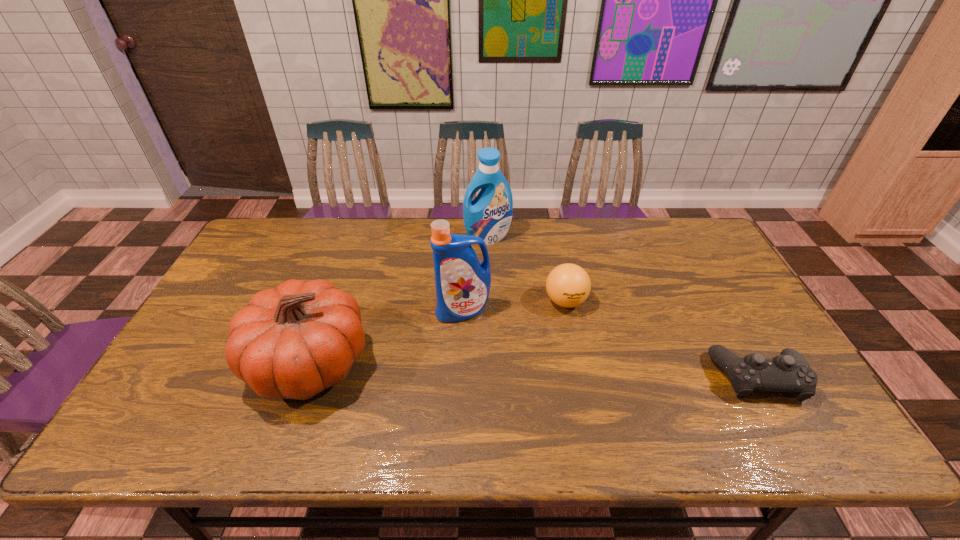
Find the location of a particular element. vacant region located 0.050m on the label of the nearer detergent is located at coordinates (468, 337).

You are a GUI agent. You are given a task and a screenshot of the screen. Output one action in this format:
    pyautogui.click(x=<x>, y=<y>)
    Task: Click on the object situated at the far edge
    Image resolution: width=960 pixels, height=540 pixels.
    Given the screenshot: What is the action you would take?
    tap(488, 216)

At what (x,y) coordinates should I click in order to perform the action: click on pumpkin that is at the near edge. Please return your answer as a coordinate pair (x, y). The width and height of the screenshot is (960, 540). Looking at the image, I should click on (293, 341).

This screenshot has width=960, height=540. Find the location of `control that is at the near edge`. control that is at the near edge is located at coordinates (789, 372).

This screenshot has width=960, height=540. Find the location of `object that is at the right edge`. object that is at the right edge is located at coordinates (789, 372).

Where is `object that is at the near right corner`? object that is at the near right corner is located at coordinates (789, 372).

This screenshot has width=960, height=540. In the image, there is a desktop. What are the coordinates of `free space at the far edge` in the screenshot? It's located at (399, 237).

At what (x,y) coordinates should I click in order to perform the action: click on vacant space at the near edge of the desktop. Please return your answer as a coordinate pair (x, y). Image resolution: width=960 pixels, height=540 pixels. Looking at the image, I should click on (742, 399).

You are a GUI agent. You are given a task and a screenshot of the screen. Output one action in this format:
    pyautogui.click(x=<x>, y=<y>)
    Task: Click on the free region at the left edge of the desktop
    The image size is (960, 540).
    Given the screenshot: What is the action you would take?
    pyautogui.click(x=204, y=321)

Locate an element on the screen. The height and width of the screenshot is (540, 960). free region at the far left corner is located at coordinates (286, 247).